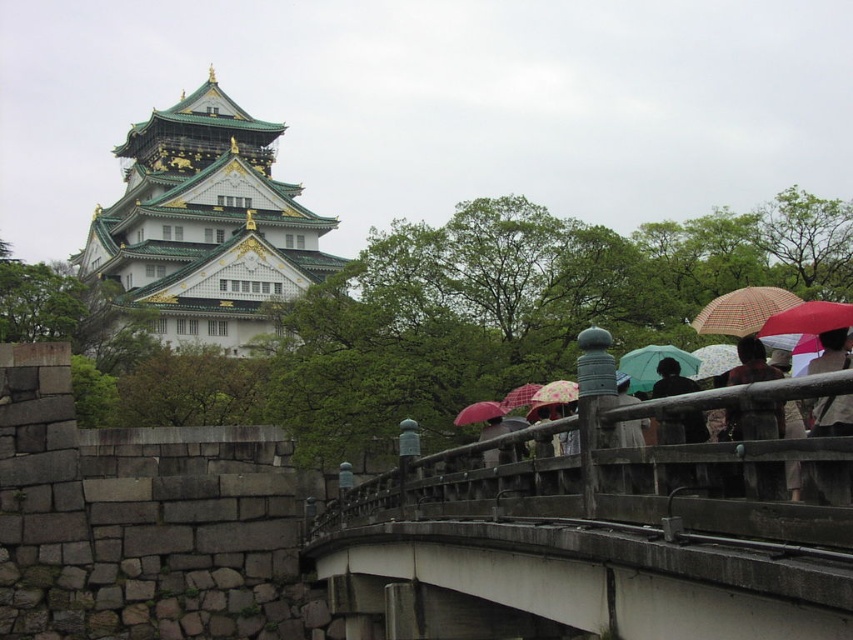
Is matte black umbrella at upper right closer to camera compared to matte red umbrella at center?

Yes, matte black umbrella at upper right is closer to the viewer.

This screenshot has height=640, width=853. Describe the element at coordinates (833, 416) in the screenshot. I see `matte black umbrella at upper right` at that location.

You are a GUI agent. You are given a task and a screenshot of the screen. Output one action in this format:
    pyautogui.click(x=<x>, y=<y>)
    Task: Click on the matte black umbrella at upper right
    
    Given the screenshot: What is the action you would take?
    tap(833, 416)

Which is more to the left, plaid fabric umbrella at upper right or matte black umbrella at center?

matte black umbrella at center is more to the left.

Can you confirm if plaid fabric umbrella at upper right is thinner than matte black umbrella at center?

No, plaid fabric umbrella at upper right is not thinner than matte black umbrella at center.

Describe the element at coordinates (741, 310) in the screenshot. The image size is (853, 640). I see `plaid fabric umbrella at upper right` at that location.

This screenshot has height=640, width=853. I want to click on plaid fabric umbrella at upper right, so click(741, 310).

Is point (764, 285) less distant than point (483, 401)?

No, (764, 285) is behind (483, 401).

Measure the distance between plaid fabric umbrella at upper right and camera.

plaid fabric umbrella at upper right and camera are 147.08 feet apart from each other.

Find the location of a particular element. plaid fabric umbrella at upper right is located at coordinates (741, 310).